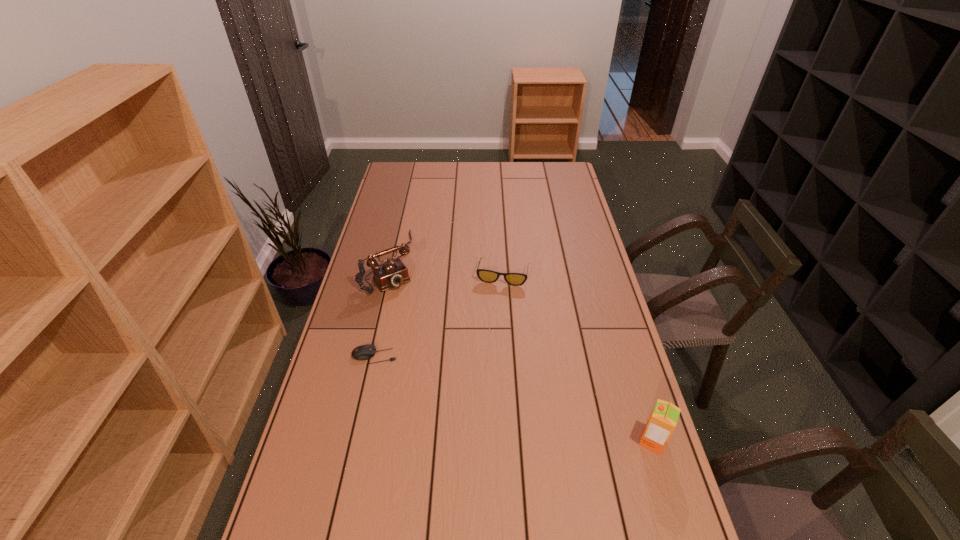
Image resolution: width=960 pixels, height=540 pixels. What are the coordinates of `free region at the left edge` in the screenshot? It's located at (383, 247).

In the image, there is a desktop. Identify the location of free region at the right edge. (583, 264).

Find the location of a particular element. The width and height of the screenshot is (960, 540). vacant space at the near left corner of the desktop is located at coordinates (296, 510).

You are a GUI agent. You are given a task and a screenshot of the screen. Output one action in this format:
    pyautogui.click(x=<x>, y=<y>)
    Task: Click on the vacant space at the far right corner of the desktop
    The height and width of the screenshot is (540, 960).
    Given the screenshot: What is the action you would take?
    pyautogui.click(x=541, y=169)

Where is `vacant space at the near right corner of the desktop`? vacant space at the near right corner of the desktop is located at coordinates (665, 536).

Where is `vacant area that lies between the third farthest object and the nearest object`? Image resolution: width=960 pixels, height=540 pixels. vacant area that lies between the third farthest object and the nearest object is located at coordinates (514, 399).

Identify the location of vacant space that is in between the nearest object and the telephone. The width and height of the screenshot is (960, 540). (521, 351).

Locate an element on the screen. The height and width of the screenshot is (540, 960). vacant point located between the shortest object and the nearest object is located at coordinates (514, 399).

Where is `vacant point located between the orange juice and the shortest object`? vacant point located between the orange juice and the shortest object is located at coordinates (514, 399).

The image size is (960, 540). I want to click on free space between the telephone and the mouse, so click(x=382, y=309).